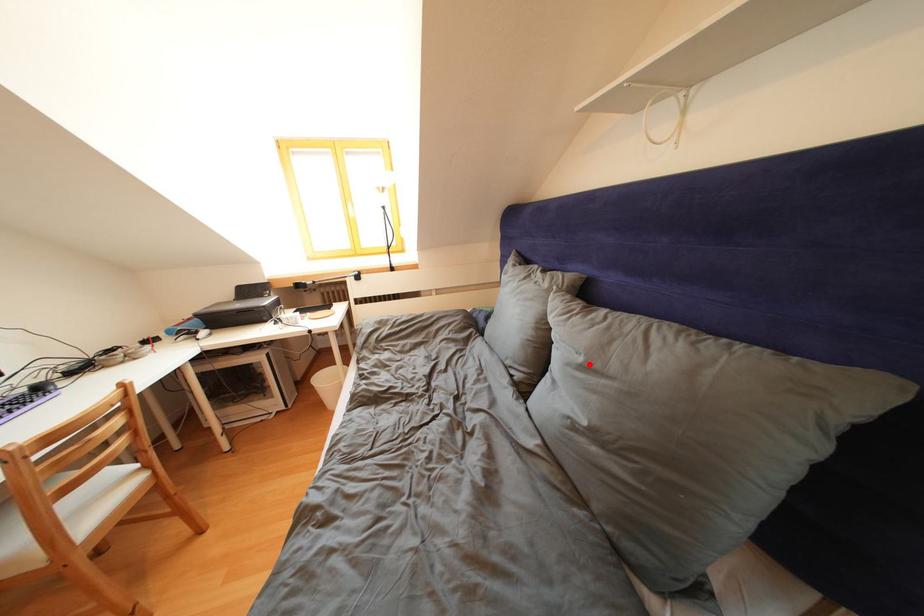
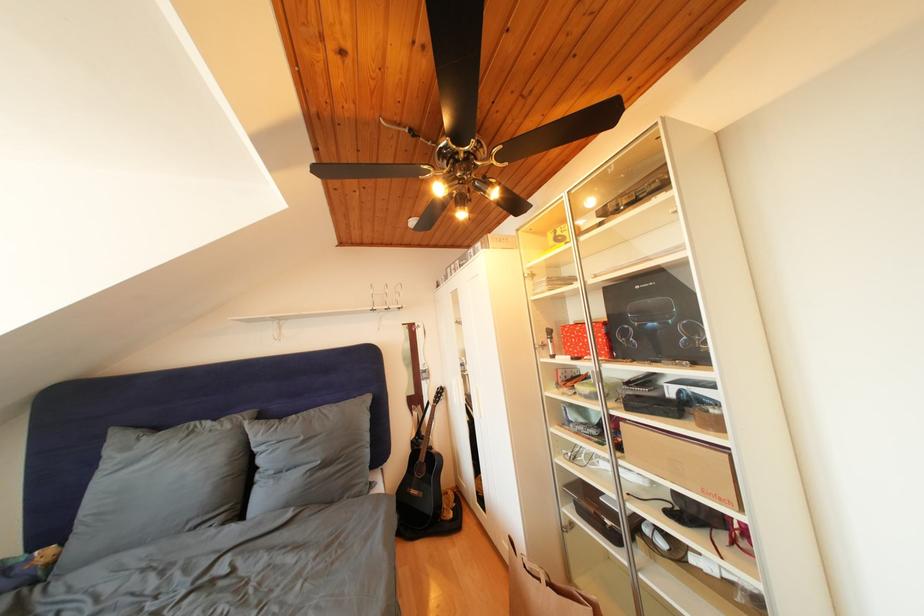
Question: I am providing you with two images of the same scene from different viewpoints. A red point is shown in image1. For the corresponding object point in image2, is it positioned nearer or farther from the camera?

Choices:
 (A) Nearer
 (B) Farther

Answer: (B)